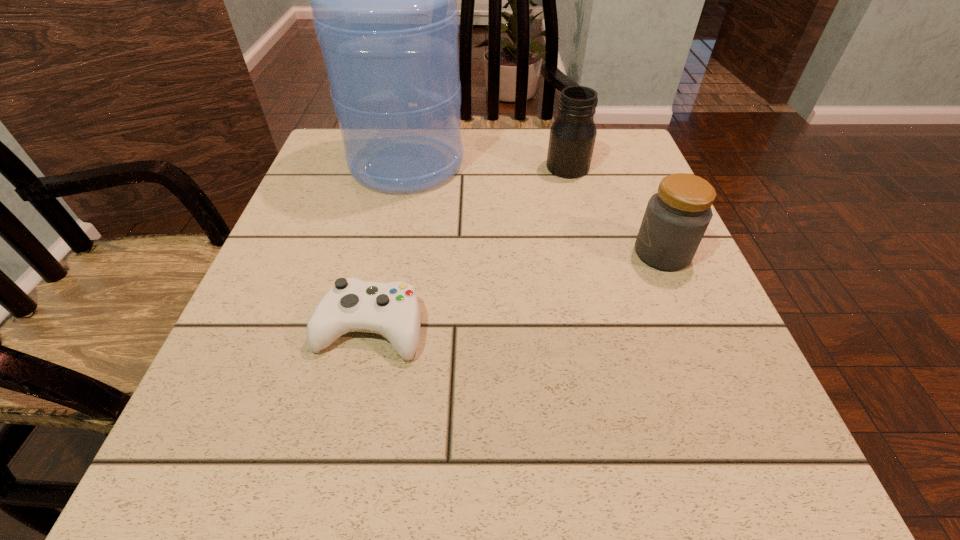
Locate an element on the screen. The image size is (960, 540). blank space located 0.290m on the surface of the rightmost object near the warning symbol is located at coordinates (479, 253).

Where is `vacant area situated 0.120m on the right of the control`? The height and width of the screenshot is (540, 960). vacant area situated 0.120m on the right of the control is located at coordinates (498, 328).

Find the location of `water jug positioned at the far edge`. water jug positioned at the far edge is located at coordinates (384, 7).

Locate an element on the screen. The width and height of the screenshot is (960, 540). jar that is at the far edge is located at coordinates (572, 137).

This screenshot has height=540, width=960. What are the coordinates of `water jug located in the left edge section of the desktop` in the screenshot? It's located at 384,7.

Where is `control that is at the left edge`? control that is at the left edge is located at coordinates (392, 310).

At what (x,y) coordinates should I click in order to perform the action: click on object situated at the far left corner. Please return your answer as a coordinate pair (x, y). Looking at the image, I should click on (384, 7).

Find the location of `object at the far right corner`. object at the far right corner is located at coordinates (572, 137).

Locate an element on the screen. The height and width of the screenshot is (540, 960). vacant space at the far edge of the desktop is located at coordinates coord(470,176).

You are a GUI agent. You are given a task and a screenshot of the screen. Output one action in this format:
    pyautogui.click(x=<x>, y=<y>)
    Task: Click on the free space at the near edge of the desktop
    The height and width of the screenshot is (540, 960).
    Given the screenshot: What is the action you would take?
    pyautogui.click(x=531, y=434)